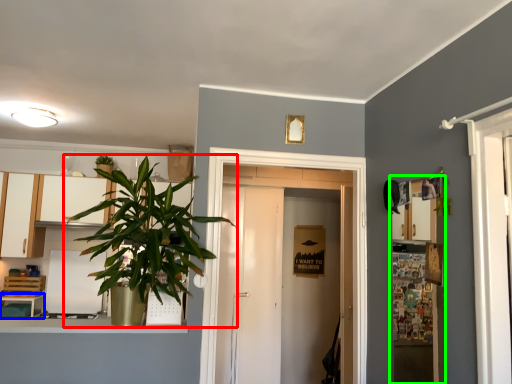
Question: Based on their relative distances, which object is farther from houseplant (highlighted by a red box)? Choose from table (highlighted by a blue box) and shelf (highlighted by a green box).

Choices:
 (A) table
 (B) shelf

Answer: (B)